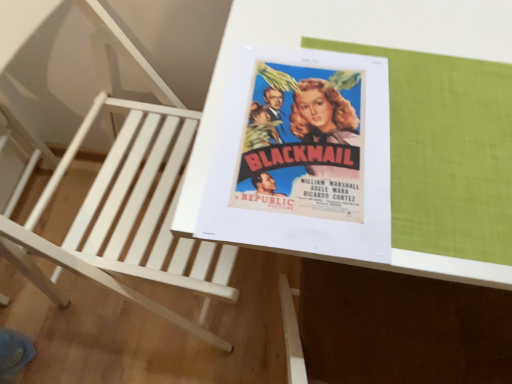
Locate an element on the screen. The height and width of the screenshot is (384, 512). vacant area on the back side of matte paper poster at center is located at coordinates (329, 28).